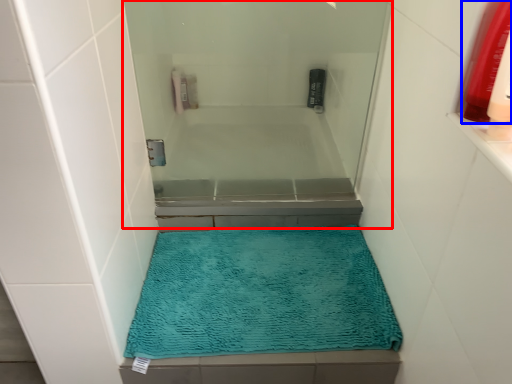
Question: Among these objects, which one is nearest to the camera, screen door (highlighted by a red box) or mouthwash (highlighted by a blue box)?

Choices:
 (A) screen door
 (B) mouthwash

Answer: (B)